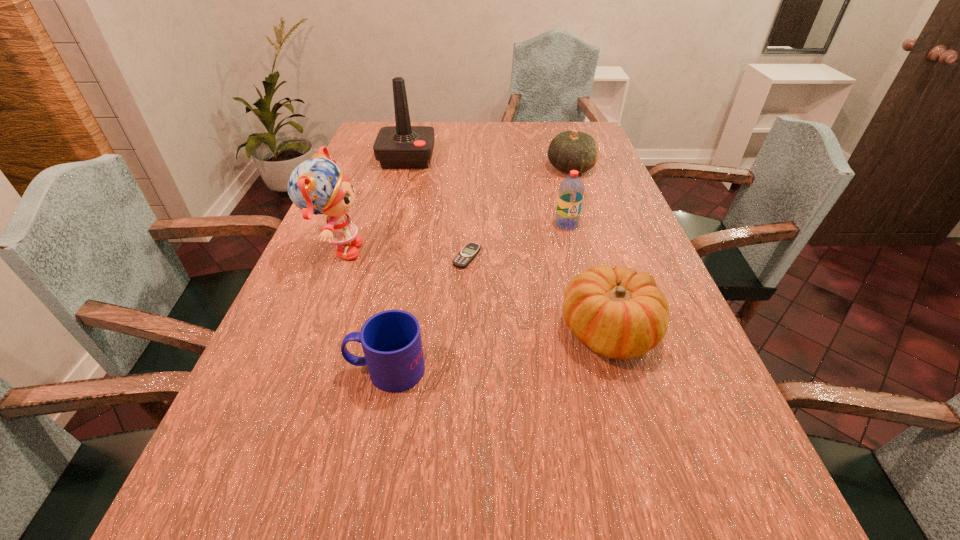
Locate an element on the screen. joystick is located at coordinates (403, 146).

You are a GUI agent. You are given a task and a screenshot of the screen. Output one action in this format:
    pyautogui.click(x=<x>, y=<y>)
    Task: Click on the doll
    The width and height of the screenshot is (960, 540).
    Given the screenshot: What is the action you would take?
    pyautogui.click(x=317, y=186)

This screenshot has height=540, width=960. I want to click on the fifth shortest object, so click(x=571, y=190).

Where is `the farther gourd`? the farther gourd is located at coordinates (571, 150).

The image size is (960, 540). In order to click on the nearer gourd in this screenshot , I will do `click(618, 313)`.

At what (x,y) coordinates should I click in order to perform the action: click on the sixth tallest object. Please return your answer as a coordinate pair (x, y). Image resolution: width=960 pixels, height=540 pixels. Looking at the image, I should click on click(x=391, y=341).

The width and height of the screenshot is (960, 540). I want to click on the shortest object, so click(x=470, y=250).

Where is `beeper`? The image size is (960, 540). beeper is located at coordinates (470, 250).

This screenshot has width=960, height=540. In order to click on vacant space located on the front of the joystick in this screenshot , I will do `click(385, 239)`.

Locate an element on the screen. vacant space located 0.100m on the face of the doll is located at coordinates (404, 252).